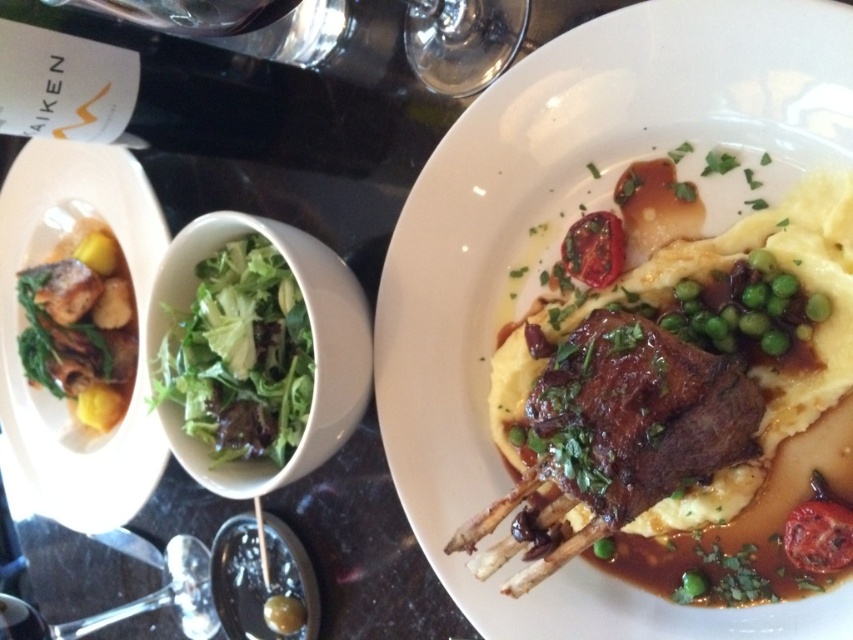
Question: Estimate the real-world distances between objects in this image. Which object is closer to the matte white plate at left?

Choices:
 (A) transparent glass at upper center
 (B) golden brown fish fillet at left

Answer: (B)

Question: Is the position of brown glazed lamb chop at center less distant than that of golden brown fish fillet at left?

Choices:
 (A) no
 (B) yes

Answer: (B)

Question: Which of the following is the closest to the observer?

Choices:
 (A) transparent glass at upper center
 (B) brown glazed lamb chop at center
 (C) slightly charred tomato at upper center
 (D) golden brown fish fillet at left

Answer: (B)

Question: Among these objects, which one is farthest from the camera?

Choices:
 (A) slightly charred tomato at upper center
 (B) green leafymaterial/texturevegetable at center

Answer: (A)

Question: Is brown glazed lamb chop at center wider than transparent glass at upper center?

Choices:
 (A) yes
 (B) no

Answer: (A)

Question: Does brown glazed lamb chop at center appear over golden brown fish fillet at left?

Choices:
 (A) yes
 (B) no

Answer: (B)